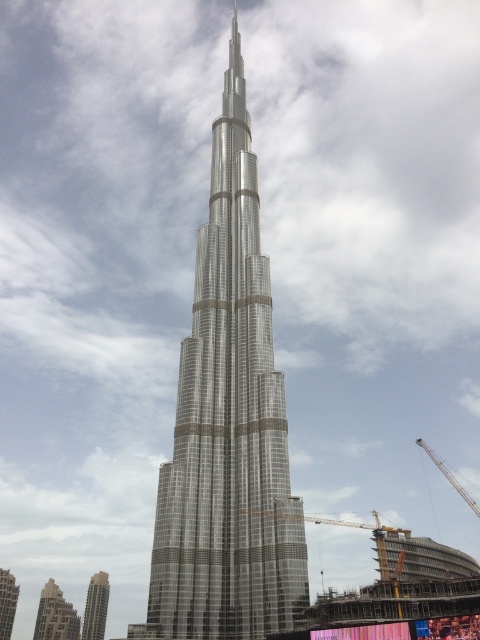
You are a construction worker standing at the base of the silver metallic skyscraper at center. You need to reach the metallic silver crane at right. Which direction should you walk to get there?

The silver metallic skyscraper at center is located below the metallic silver crane at right, so you should walk upwards to reach the metallic silver crane at right.

Based on the given coordinates, where is the silver metallic tower at center located in the image?

The silver metallic tower at center is located at the coordinates point (x=228, y=426) in the image.

You are a construction worker standing at the base of the metallic yellow crane at lower center. You need to deliver a tool to a worker on the silver metallic skyscraper at center. The tool requires a direct line of sight to be thrown. Can you throw the tool directly to the worker without it hitting any obstacles?

The metallic yellow crane at lower center and silver metallic skyscraper at center are 80.03 meters apart. Since the tool needs a direct line of sight and the distance is 80.03 meters, it is possible to throw the tool directly as there are no obstacles mentioned between them according to the scene description.